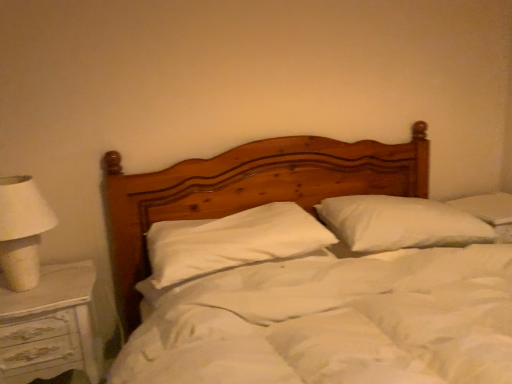
Question: Does wooden bed at center lie in front of white soft pillow at center, which is counted as the 2th pillow, starting from the right?

Choices:
 (A) no
 (B) yes

Answer: (B)

Question: From the image's perspective, is wooden bed at center located beneath white soft pillow at center, which is counted as the 2th pillow, starting from the right?

Choices:
 (A) yes
 (B) no

Answer: (A)

Question: Is wooden bed at center facing away from white soft pillow at center, the 1th pillow when ordered from left to right?

Choices:
 (A) yes
 (B) no

Answer: (A)

Question: Does wooden bed at center appear on the left side of white soft pillow at center, which is counted as the 2th pillow, starting from the right?

Choices:
 (A) no
 (B) yes

Answer: (A)

Question: Would you consider wooden bed at center to be distant from white soft pillow at center, which is counted as the 2th pillow, starting from the right?

Choices:
 (A) no
 (B) yes

Answer: (A)

Question: Is wooden bed at center smaller than white soft pillow at center, the 1th pillow when ordered from left to right?

Choices:
 (A) no
 (B) yes

Answer: (A)

Question: Is white fabric lampshade at left bigger than wooden bed at center?

Choices:
 (A) no
 (B) yes

Answer: (A)

Question: Is white fabric lampshade at left outside of wooden bed at center?

Choices:
 (A) yes
 (B) no

Answer: (A)

Question: Is white fabric lampshade at left wider than wooden bed at center?

Choices:
 (A) yes
 (B) no

Answer: (B)

Question: Is white fabric lampshade at left turned away from wooden bed at center?

Choices:
 (A) yes
 (B) no

Answer: (B)

Question: Is white fabric lampshade at left far away from wooden bed at center?

Choices:
 (A) yes
 (B) no

Answer: (B)

Question: From the image's perspective, would you say white fabric lampshade at left is shown under wooden bed at center?

Choices:
 (A) no
 (B) yes

Answer: (A)

Question: Can white painted wood nightstand at left be found inside white soft pillow at center, which is counted as the 2th pillow, starting from the right?

Choices:
 (A) no
 (B) yes

Answer: (A)